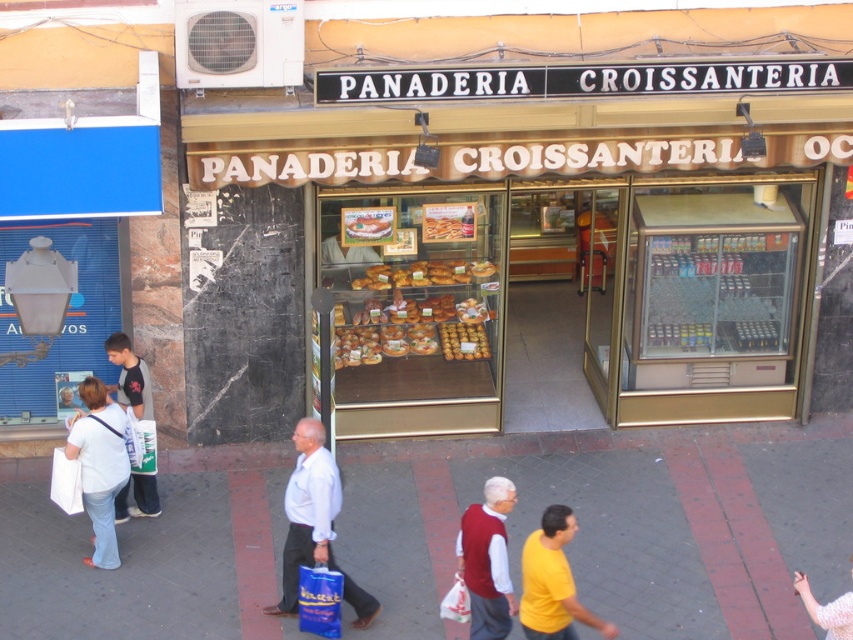
Consider the image. Measure the distance between point [403,275] and camera.

A distance of 34.69 feet exists between point [403,275] and camera.

Can you confirm if golden brown pastries at center is positioned to the left of maroon sweater at center?

Yes, golden brown pastries at center is to the left of maroon sweater at center.

Which is behind, point (480, 291) or point (511, 588)?

Point (480, 291)

Where is `golden brown pastries at center`? This screenshot has height=640, width=853. golden brown pastries at center is located at coordinates (418, 312).

Who is shorter, maroon sweater at center or golden brown pastry at center?

With less height is golden brown pastry at center.

What are the coordinates of `maroon sweater at center` in the screenshot? It's located at (486, 561).

Is point (514, 493) closer to camera compared to point (439, 216)?

Yes, point (514, 493) is in front of point (439, 216).

Locate an element on the screen. This screenshot has height=640, width=853. maroon sweater at center is located at coordinates 486,561.

Who is more forward, (x=370, y=611) or (x=492, y=524)?

Point (x=492, y=524) is in front.

Who is more distant from viewer, (325, 557) or (509, 500)?

Point (325, 557)

Where is `white cotton shirt at center`? The image size is (853, 640). white cotton shirt at center is located at coordinates (308, 512).